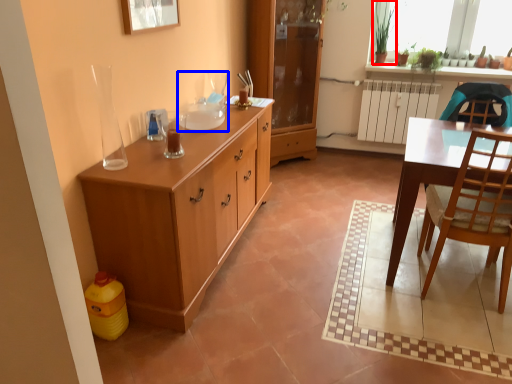
Question: Which point is further to the camera, houseplant (highlighted by a red box) or sink (highlighted by a blue box)?

Choices:
 (A) houseplant
 (B) sink

Answer: (A)